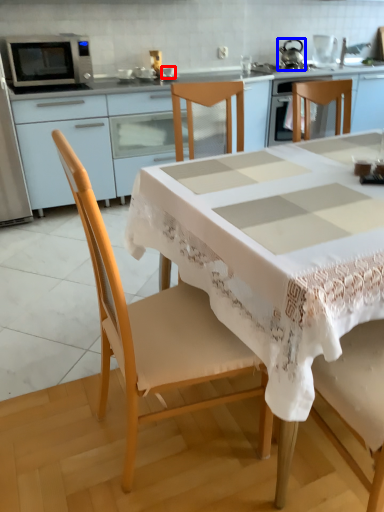
Question: Which object is closer to the camera taking this photo, tableware (highlighted by a red box) or tea pot (highlighted by a blue box)?

Choices:
 (A) tableware
 (B) tea pot

Answer: (A)